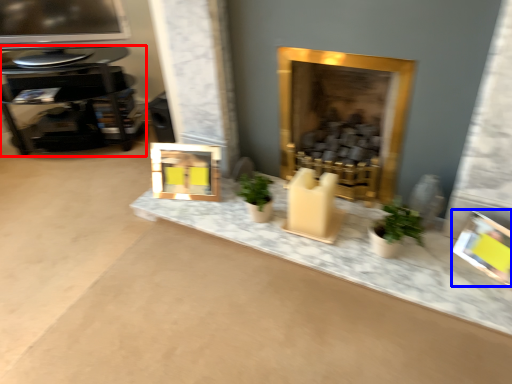
Question: Which of the following is the farthest to the observer, table (highlighted by a red box) or picture frame (highlighted by a blue box)?

Choices:
 (A) table
 (B) picture frame

Answer: (A)